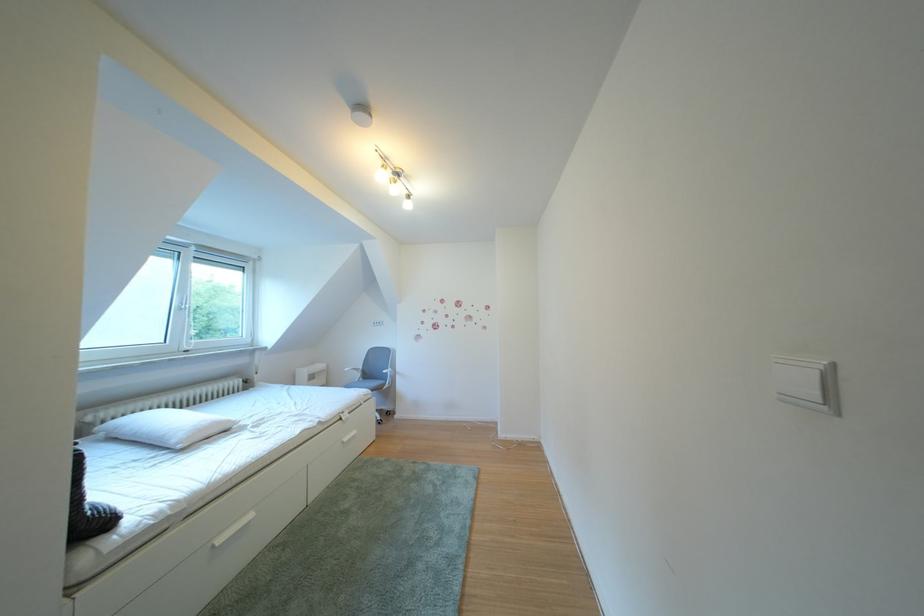
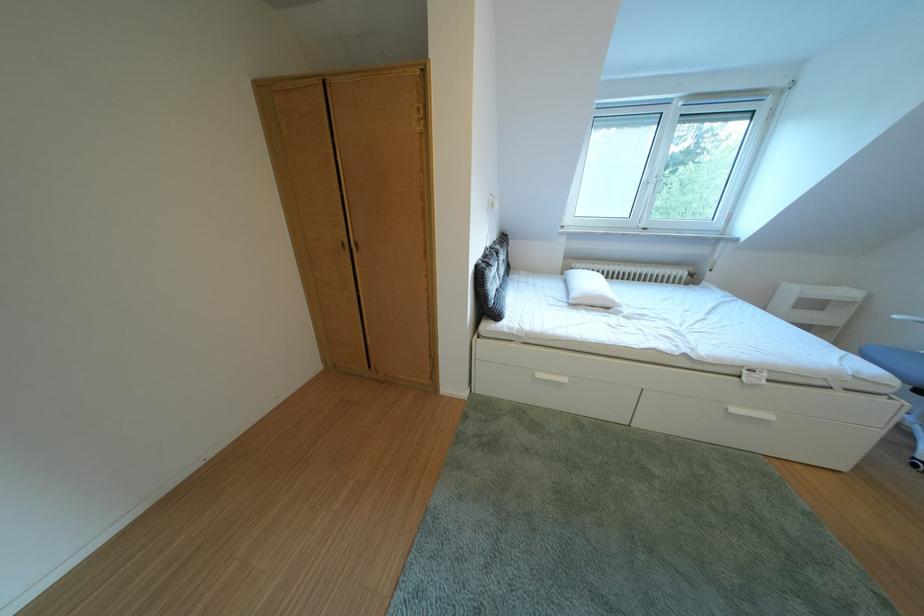
Where in the second image is the point corresponding to point 359,445 from the first image?

(748, 415)